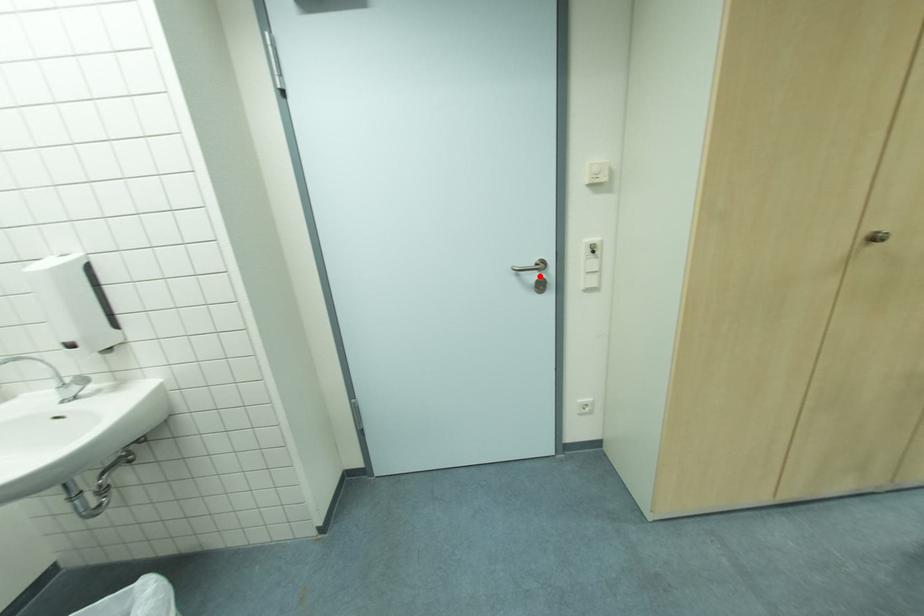
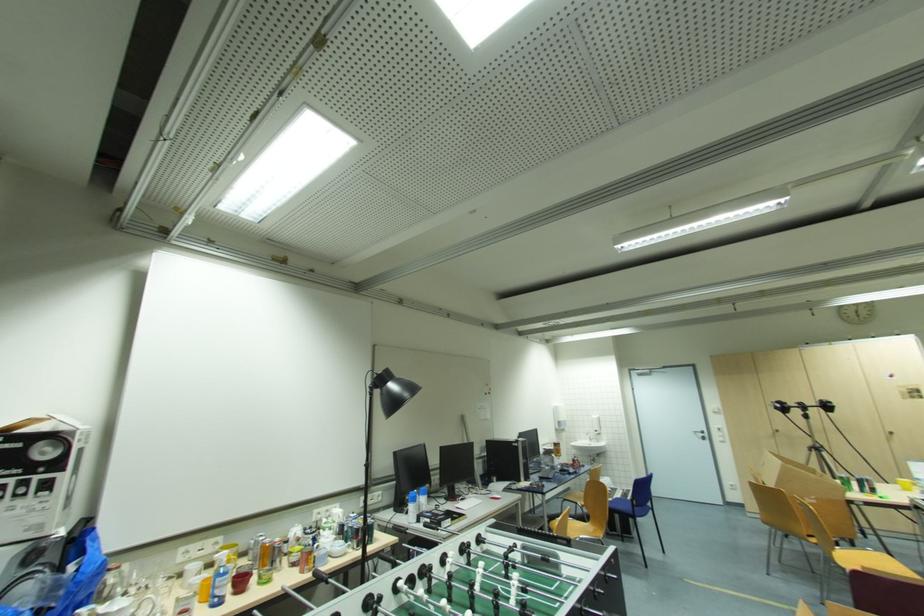
Where in the second image is the point corresponding to the highlighted location from the first image?

(706, 436)